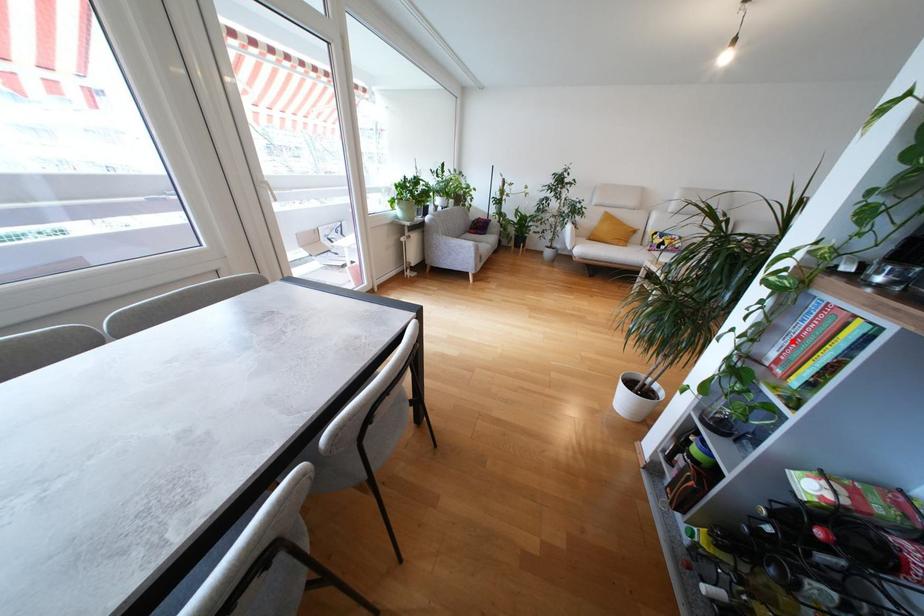
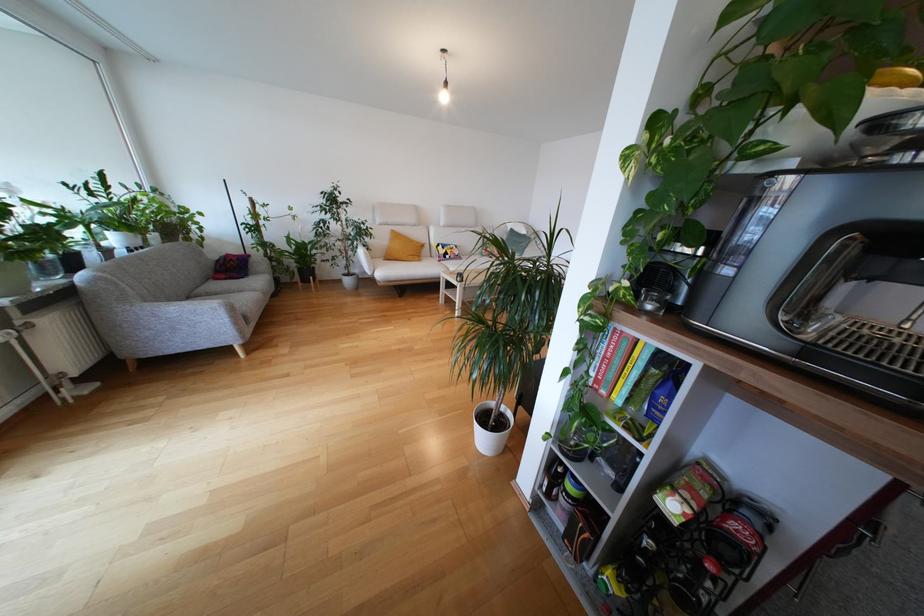
Question: I am providing you with two images of the same scene from different viewpoints. A red point is marked on the first image. Can you still see the location of the red point in image 2?

Choices:
 (A) Yes
 (B) No

Answer: (A)